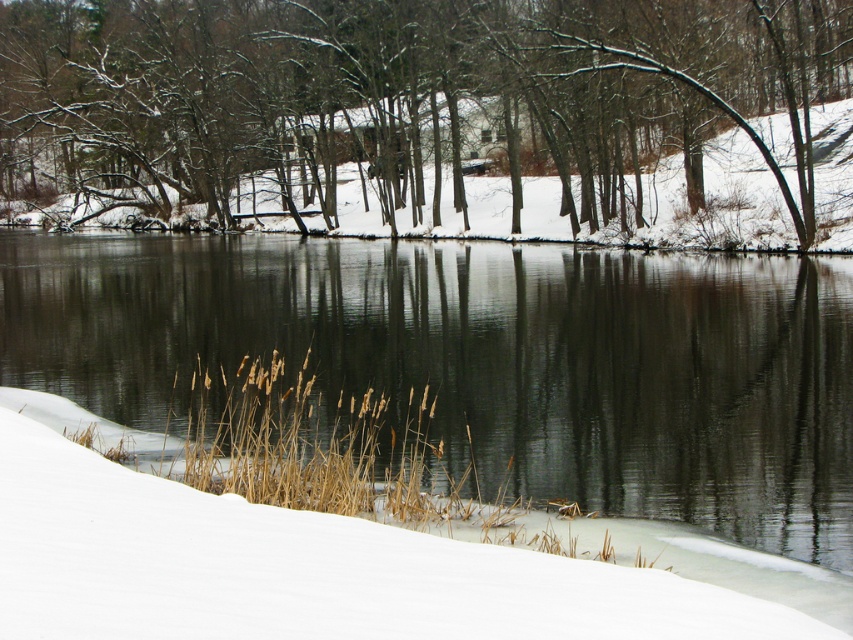
You are standing at the edge of the snowy embankment and want to step onto the white fluffy snow at lower center. Is the clear water at center between you and the snow?

The clear water at center is further to the viewer than the white fluffy snow at lower center, meaning the snow is closer to you. Therefore, there is no water between you and the snow when stepping towards it.

You are an artist planning to paint the winter scene. You want to ensure the clear water at center and the white fluffy snow at lower center are proportionally accurate. Which object should you paint larger in your artwork?

The clear water at center should be painted larger than the white fluffy snow at lower center because the clear water at center has a larger size compared to white fluffy snow at lower center according to the description.